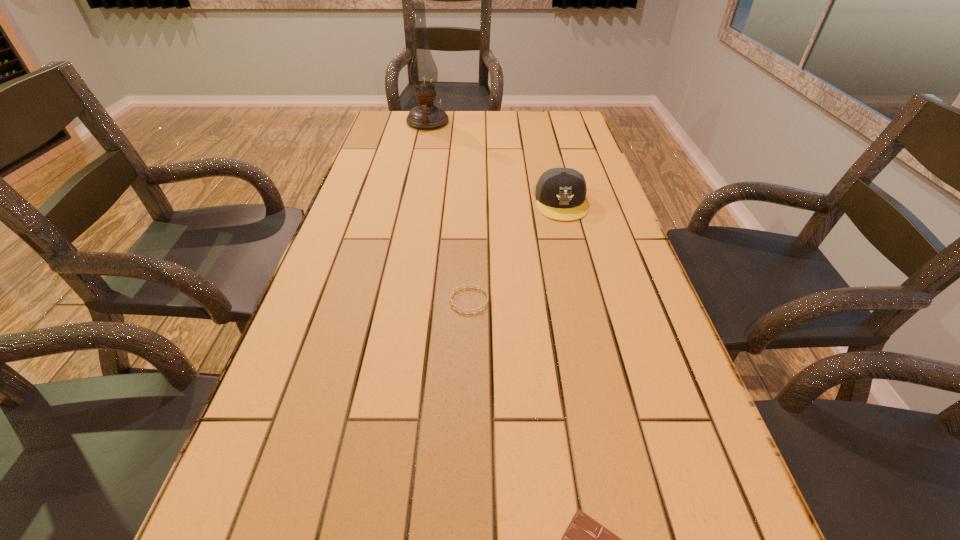
Image resolution: width=960 pixels, height=540 pixels. I want to click on oil lamp, so click(423, 71).

I want to click on the farthest object, so click(x=423, y=71).

Locate an element on the screen. This screenshot has height=540, width=960. cap is located at coordinates (560, 192).

Where is `the second tallest object`? This screenshot has width=960, height=540. the second tallest object is located at coordinates (560, 192).

You are a GUI agent. You are given a task and a screenshot of the screen. Output one action in this format:
    pyautogui.click(x=<x>, y=<y>)
    Task: Click on the second nearest object
    
    Given the screenshot: What is the action you would take?
    477,310

Identify the location of the third object from right to left. (477, 310).

I want to click on vacant space situated 0.370m on the right of the leftmost object, so click(544, 123).

I want to click on vacant area situated on the front-facing side of the third nearest object, so [x=575, y=256].

Find the location of a particular element. The image size is (960, 540). vacant space located on the surface of the third tallest object showing star-shaped elements is located at coordinates (618, 301).

Find the location of a particular element. object that is at the far edge is located at coordinates (423, 71).